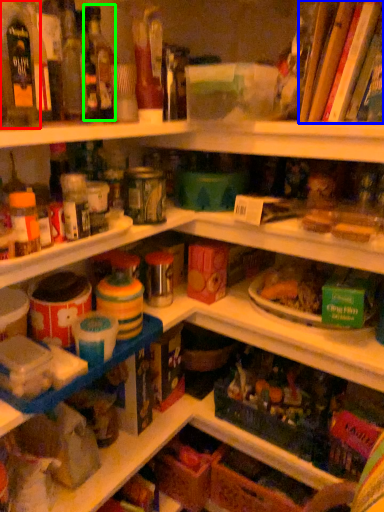
Question: Which is farther away from bottle (highlighted by a red box)? book (highlighted by a blue box) or bottle (highlighted by a green box)?

Choices:
 (A) book
 (B) bottle

Answer: (A)